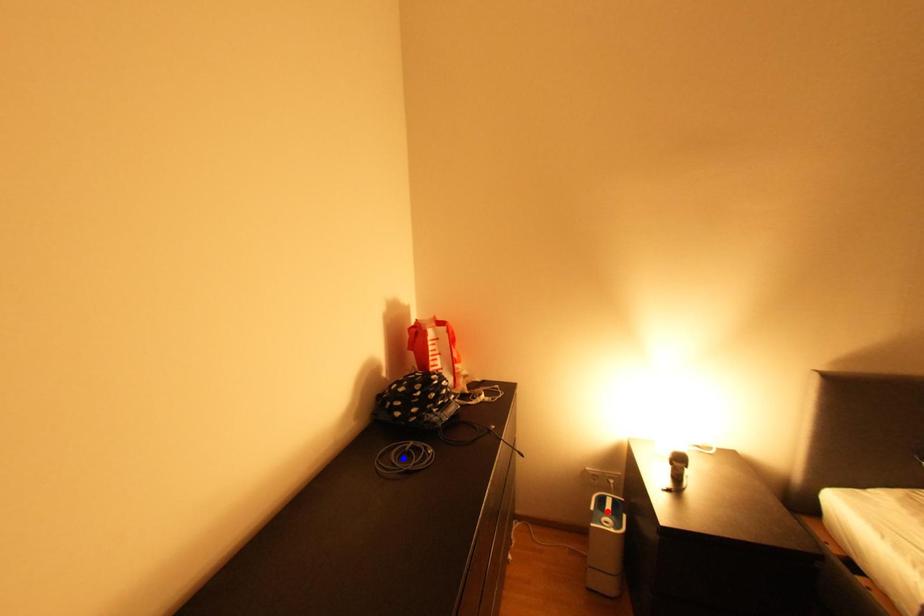
Question: In the image, two points are highlighted. Which point is nearer to the camera? Reply with the corresponding letter.

Choices:
 (A) blue point
 (B) red point

Answer: (A)